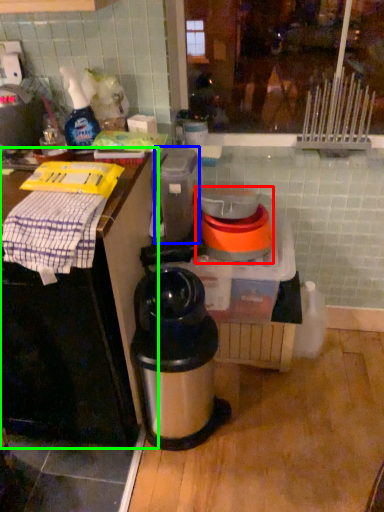
Question: Based on their relative distances, which object is nearer to appliance (highlighted by a red box)? Choose from appliance (highlighted by a blue box) and table (highlighted by a green box).

Choices:
 (A) appliance
 (B) table

Answer: (A)